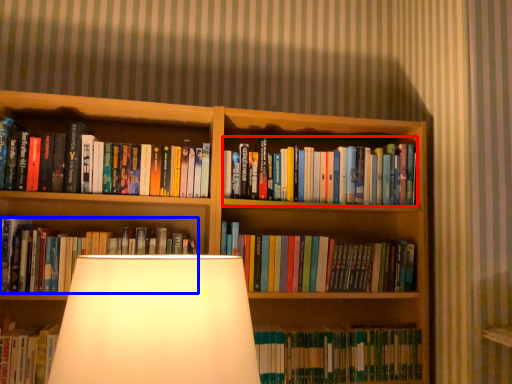
Question: Which of the following is the farthest to the observer, book (highlighted by a red box) or book (highlighted by a blue box)?

Choices:
 (A) book
 (B) book

Answer: (A)